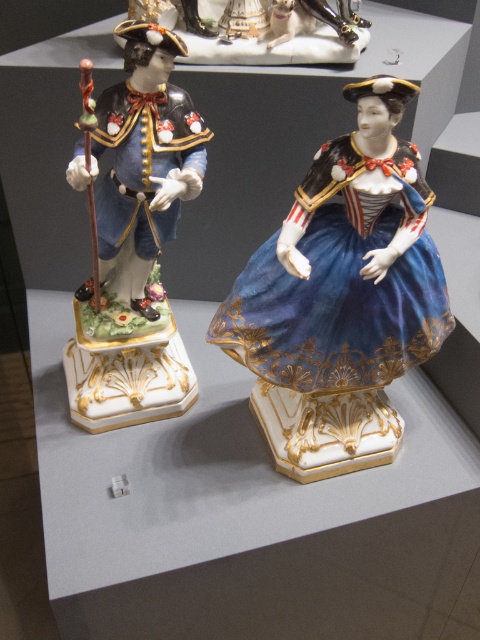
You are a museum curator arranging an exhibition. You have a velvet blue dress at center and a porcelain figurine at left. Which object is positioned to the right of the other?

The velvet blue dress at center is to the right of the porcelain figurine at left according to the description.

You are a museum curator planning to place a new rectangular display case that is 1 meter wide between the porcelain figurine at left and the porcelain statue at upper center. Based on their widths, will the display case fit between them without overlapping either object?

The porcelain figurine at left might be wider than the porcelain statue at upper center, so the display case that is 1 meter wide may not fit properly between them if the combined width of both objects exceeds the available space. However, without exact measurements, it is uncertain.

You are a museum curator planning to place a new display label next to the porcelain figurine at left and the porcelain statue at upper center. Since the label must be placed at the base of each object, which object requires a larger label base to accommodate its size?

The porcelain figurine at left requires a larger label base because it is bigger than the porcelain statue at upper center.